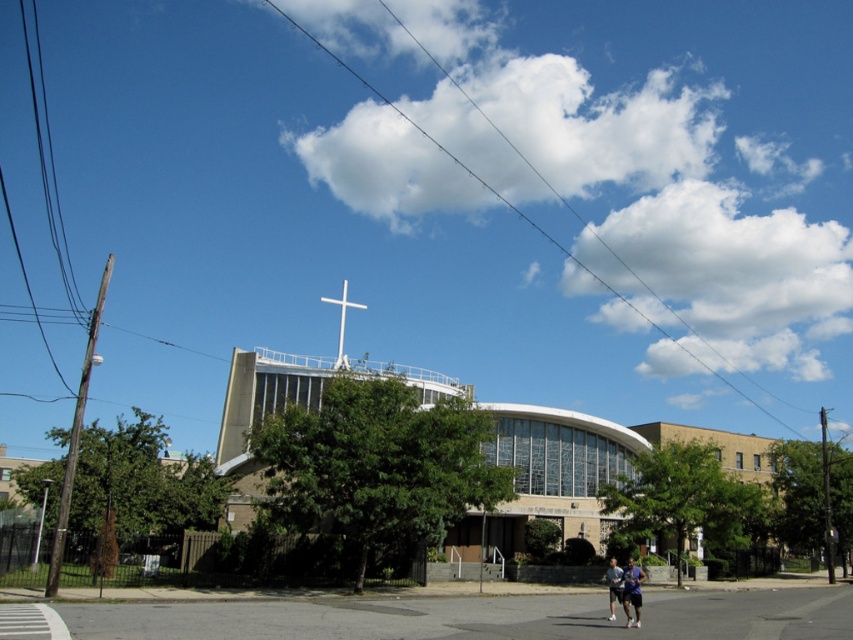
Which of these two, matte blue shorts at lower right or white metallic cross at upper center, stands taller?

white metallic cross at upper center

Does point (630, 620) come in front of point (344, 282)?

Yes, point (630, 620) is closer to viewer.

Is point (646, 577) more distant than point (334, 365)?

No, (646, 577) is closer to viewer.

At what (x,y) coordinates should I click in order to perform the action: click on matte blue shorts at lower right. Please return your answer as a coordinate pair (x, y). Looking at the image, I should click on (627, 589).